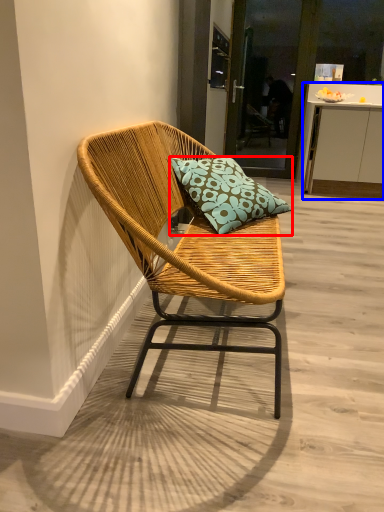
Question: Which object is further to the camera taking this photo, pillow (highlighted by a red box) or cabinetry (highlighted by a blue box)?

Choices:
 (A) pillow
 (B) cabinetry

Answer: (B)